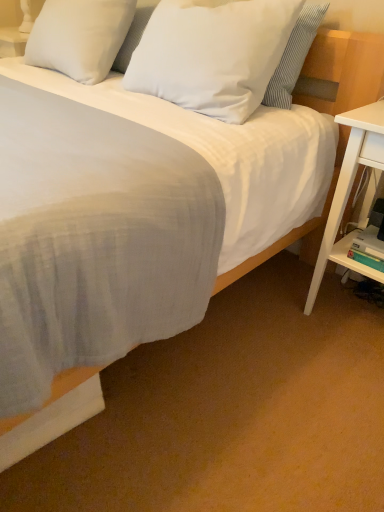
Question: From a real-world perspective, is white wood nightstand at right above or below white matte pillow at upper center, acting as the 2th pillow starting from the left?

Choices:
 (A) below
 (B) above

Answer: (A)

Question: In the image, is white wood nightstand at right positioned in front of or behind white matte pillow at upper center, acting as the 2th pillow starting from the left?

Choices:
 (A) front
 (B) behind

Answer: (A)

Question: Estimate the real-world distances between objects in this image. Which object is closer to the white wood nightstand at right?

Choices:
 (A) white plastic shelf at lower right
 (B) white soft pillow at upper center, which appears as the second pillow when viewed from the right
 (C) white matte pillow at upper center, acting as the 2th pillow starting from the left

Answer: (A)

Question: Which is farther from the white matte pillow at upper center, which appears as the 1th pillow when viewed from the right?

Choices:
 (A) white wood nightstand at right
 (B) white plastic shelf at lower right
 (C) white soft pillow at upper center, placed as the 1th pillow when sorted from left to right

Answer: (B)